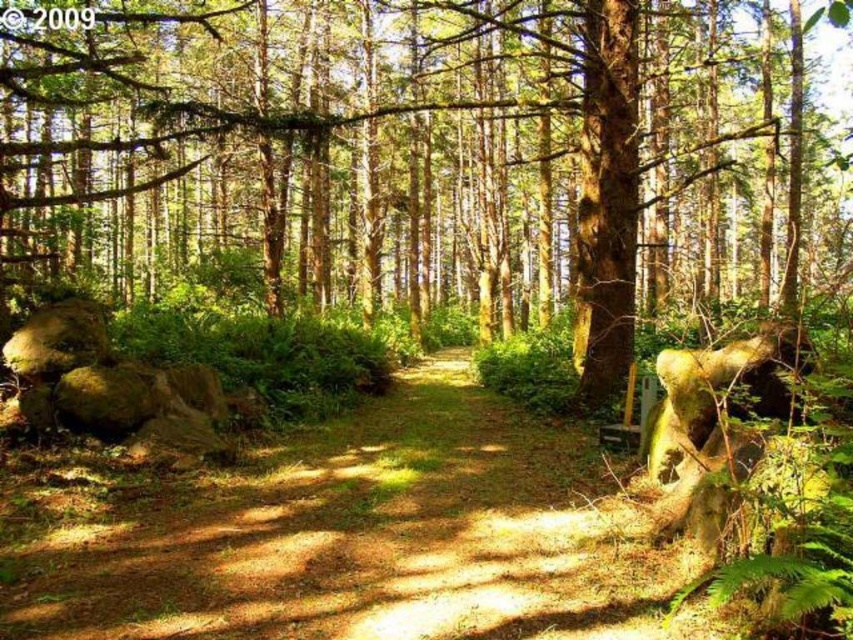
Question: Is green mossy tree at center below brown dirt path at center?

Choices:
 (A) yes
 (B) no

Answer: (B)

Question: Can you confirm if green mossy tree at center is bigger than brown dirt path at center?

Choices:
 (A) yes
 (B) no

Answer: (A)

Question: Which point is closer to the camera?

Choices:
 (A) brown dirt path at center
 (B) green mossy tree at center

Answer: (B)

Question: Is green mossy tree at center positioned before brown dirt path at center?

Choices:
 (A) no
 (B) yes

Answer: (B)

Question: Which object appears farthest from the camera in this image?

Choices:
 (A) brown dirt path at center
 (B) green mossy tree at center

Answer: (A)